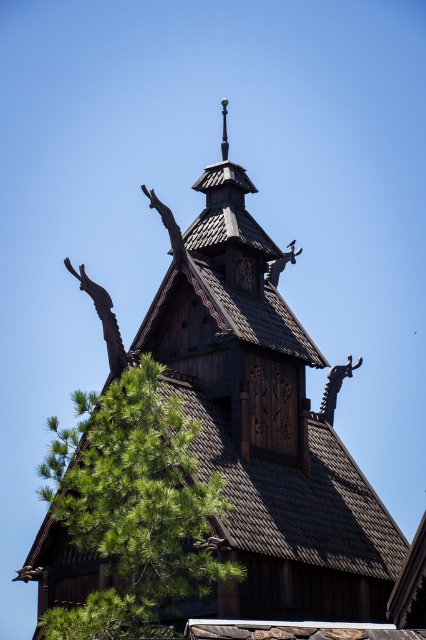
Question: Which object is closer to the camera taking this photo?

Choices:
 (A) brown wooden roof at center
 (B) green leafy tree at lower left

Answer: (B)

Question: Among these points, which one is nearest to the camera?

Choices:
 (A) (333, 561)
 (B) (121, 400)

Answer: (B)

Question: Is green leafy tree at lower left wider than brown wooden roof at center?

Choices:
 (A) yes
 (B) no

Answer: (A)

Question: Can you confirm if green leafy tree at lower left is positioned to the right of brown wooden roof at center?

Choices:
 (A) yes
 (B) no

Answer: (B)

Question: Is green leafy tree at lower left to the left of brown wooden roof at center from the viewer's perspective?

Choices:
 (A) yes
 (B) no

Answer: (A)